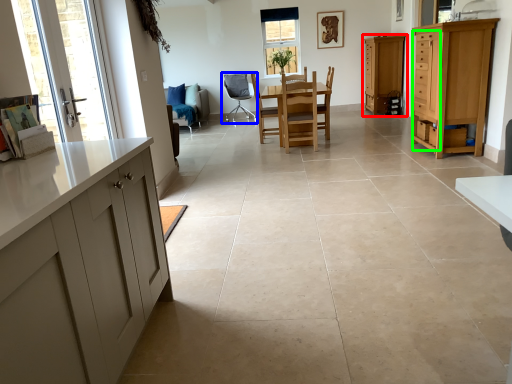
Question: Based on their relative distances, which object is farther from cabinetry (highlighted by a red box)? Choose from chair (highlighted by a blue box) and drawer (highlighted by a green box).

Choices:
 (A) chair
 (B) drawer

Answer: (B)